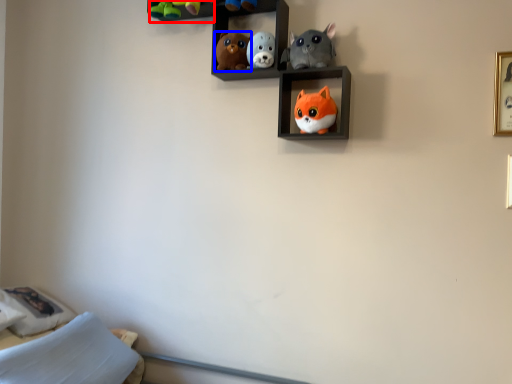
Question: Which of the following is the farthest to the observer, cabinet (highlighted by a red box) or toy (highlighted by a blue box)?

Choices:
 (A) cabinet
 (B) toy

Answer: (A)